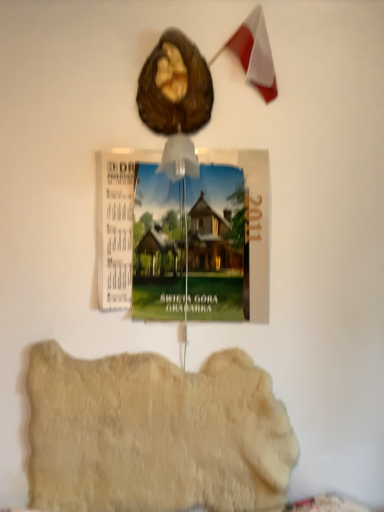
Find the location of `wooden postcard at center`. wooden postcard at center is located at coordinates (184, 237).

Find the location of a particular element. This screenshot has height=512, width=384. shiny brown nut at upper center is located at coordinates (184, 97).

From the picture: Is shiny brown nut at upper center wider or thinner than wooden postcard at center?

Clearly, shiny brown nut at upper center has more width compared to wooden postcard at center.

Is point (198, 63) more distant than point (227, 193)?

No, (198, 63) is in front of (227, 193).

From the image's perspective, is shiny brown nut at upper center located above wooden postcard at center?

Yes, from the image's perspective, shiny brown nut at upper center is on top of wooden postcard at center.

Which is behind, shiny brown nut at upper center or wooden postcard at center?

Positioned behind is wooden postcard at center.

Which object is closer to the camera taking this photo, fuzzy beige rug at lower center or wooden postcard at center?

wooden postcard at center.

Considering the sizes of objects fuzzy beige rug at lower center and wooden postcard at center in the image provided, who is taller, fuzzy beige rug at lower center or wooden postcard at center?

Standing taller between the two is wooden postcard at center.

Does fuzzy beige rug at lower center have a smaller size compared to wooden postcard at center?

Incorrect, fuzzy beige rug at lower center is not smaller in size than wooden postcard at center.

Does shiny brown nut at upper center have a smaller size compared to fuzzy beige rug at lower center?

Yes.

Is shiny brown nut at upper center directly adjacent to fuzzy beige rug at lower center?

They are not placed beside each other.

Could you tell me if shiny brown nut at upper center is turned towards fuzzy beige rug at lower center?

No, shiny brown nut at upper center is not facing towards fuzzy beige rug at lower center.

Is shiny brown nut at upper center located within wooden postcard at center?

No, wooden postcard at center does not contain shiny brown nut at upper center.

From the image's perspective, is wooden postcard at center on shiny brown nut at upper center?

No.

Can you confirm if wooden postcard at center is shorter than shiny brown nut at upper center?

Incorrect, the height of wooden postcard at center does not fall short of that of shiny brown nut at upper center.

Is wooden postcard at center to the left or to the right of shiny brown nut at upper center in the image?

In the image, wooden postcard at center appears on the right side of shiny brown nut at upper center.

Between point (228, 175) and point (178, 418), which one is positioned in front?

Point (228, 175)

Considering the relative sizes of wooden postcard at center and fuzzy beige rug at lower center in the image provided, is wooden postcard at center smaller than fuzzy beige rug at lower center?

Indeed, wooden postcard at center has a smaller size compared to fuzzy beige rug at lower center.

From the image's perspective, between wooden postcard at center and fuzzy beige rug at lower center, which one is located above?

wooden postcard at center is shown above in the image.

Is wooden postcard at center positioned with its back to fuzzy beige rug at lower center?

No, wooden postcard at center's orientation is not away from fuzzy beige rug at lower center.

Is point (38, 432) more distant than point (154, 82)?

Yes, it is.

The height and width of the screenshot is (512, 384). Identify the location of food behind the shiny brown nut at upper center. (155, 433).

Is the surface of fuzzy beige rug at lower center in direct contact with shiny brown nut at upper center?

No.

Could you tell me if fuzzy beige rug at lower center is turned towards shiny brown nut at upper center?

No, fuzzy beige rug at lower center is not aimed at shiny brown nut at upper center.

Find the location of a particular element. animal above the wooden postcard at center (from the image's perspective) is located at coordinates (184, 97).

This screenshot has height=512, width=384. I want to click on postcard lying on the right of fuzzy beige rug at lower center, so click(x=184, y=237).

When comparing their distances from wooden postcard at center, does shiny brown nut at upper center or fuzzy beige rug at lower center seem closer?

shiny brown nut at upper center is positioned closer to the anchor wooden postcard at center.

Which object lies nearer to the anchor point shiny brown nut at upper center, fuzzy beige rug at lower center or wooden postcard at center?

Among the two, wooden postcard at center is located nearer to shiny brown nut at upper center.

Estimate the real-world distances between objects in this image. Which object is further from wooden postcard at center, fuzzy beige rug at lower center or shiny brown nut at upper center?

Among the two, fuzzy beige rug at lower center is located further to wooden postcard at center.

Estimate the real-world distances between objects in this image. Which object is further from fuzzy beige rug at lower center, shiny brown nut at upper center or wooden postcard at center?

shiny brown nut at upper center is further to fuzzy beige rug at lower center.

Looking at the image, which one is located closer to shiny brown nut at upper center, wooden postcard at center or fuzzy beige rug at lower center?

Based on the image, wooden postcard at center appears to be nearer to shiny brown nut at upper center.

Based on their spatial positions, is wooden postcard at center or shiny brown nut at upper center further from fuzzy beige rug at lower center?

shiny brown nut at upper center lies further to fuzzy beige rug at lower center than the other object.

Locate an element on the screen. The image size is (384, 512). postcard between shiny brown nut at upper center and fuzzy beige rug at lower center from top to bottom is located at coordinates (184, 237).